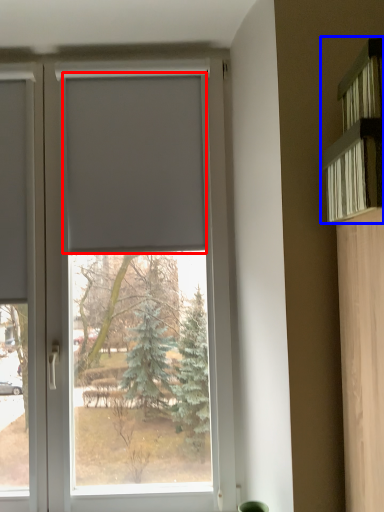
Question: Which object is further to the camera taking this photo, blind (highlighted by a red box) or shelf (highlighted by a blue box)?

Choices:
 (A) blind
 (B) shelf

Answer: (A)